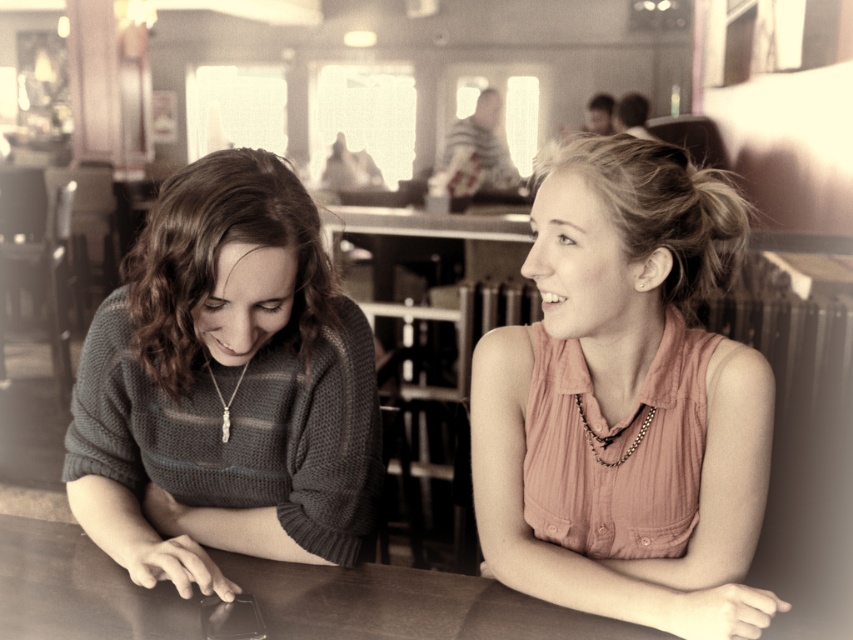
Question: Is pink fabric shirt at upper right smaller than gold chain necklace at center?

Choices:
 (A) no
 (B) yes

Answer: (A)

Question: Which point is closer to the camera taking this photo?

Choices:
 (A) (602, 442)
 (B) (746, 516)

Answer: (B)

Question: Which object is positioned farthest from the brown wooden table at center?

Choices:
 (A) pink fabric shirt at upper right
 (B) gold chain necklace at center
 (C) gold chain necklace at lower center

Answer: (B)

Question: Does knitted sweater at left appear over gold chain necklace at center?

Choices:
 (A) yes
 (B) no

Answer: (A)

Question: Which point is farther to the camera?

Choices:
 (A) (648, 412)
 (B) (183, 548)

Answer: (B)

Question: Can you confirm if knitted sweater at left is smaller than brown wooden table at center?

Choices:
 (A) yes
 (B) no

Answer: (B)